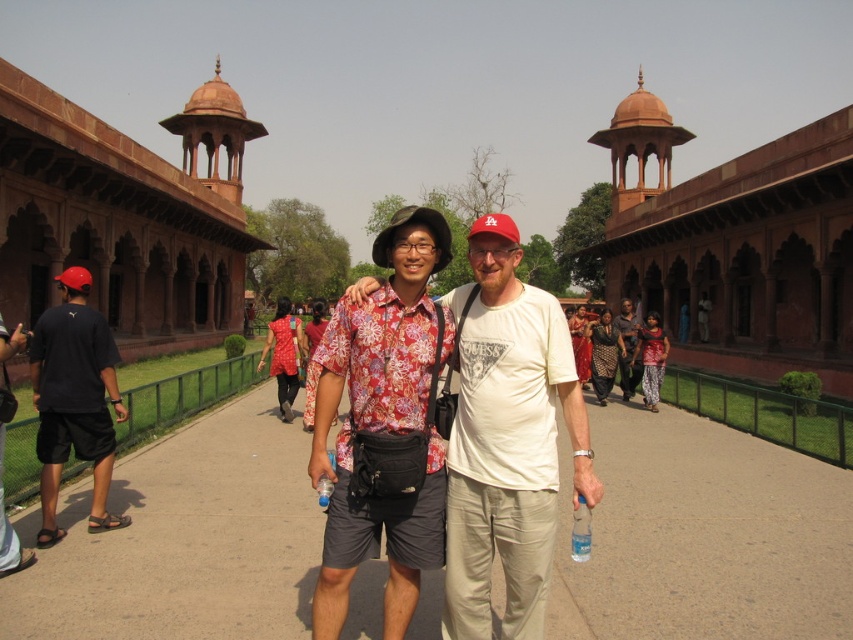
You are standing at the point marked as point (383,422) in the image. What is the color of the fabric you are standing on?

The point (383,422) is on floral fabric shirt at center, so the fabric is floral patterned.

You are a photographer trying to capture a candid shot of the white cotton t shirt at center. The photographer is standing at the point marked by the coordinate point (508, 440). What is the best position to take a photo of the white cotton t shirt at center without being noticed?

The photographer is already positioned exactly at the location of the white cotton t shirt at center, as indicated by the coordinate point (508, 440). Therefore, they would need to move away from that spot to capture the subject effectively.